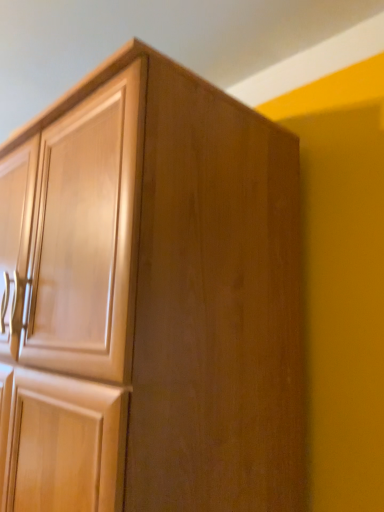
The image size is (384, 512). Describe the element at coordinates (151, 300) in the screenshot. I see `matte wood cupboard at upper center` at that location.

The image size is (384, 512). Find the location of `matte wood cupboard at upper center`. matte wood cupboard at upper center is located at coordinates (151, 300).

Where is `matte wood cupboard at upper center`? The width and height of the screenshot is (384, 512). matte wood cupboard at upper center is located at coordinates (151, 300).